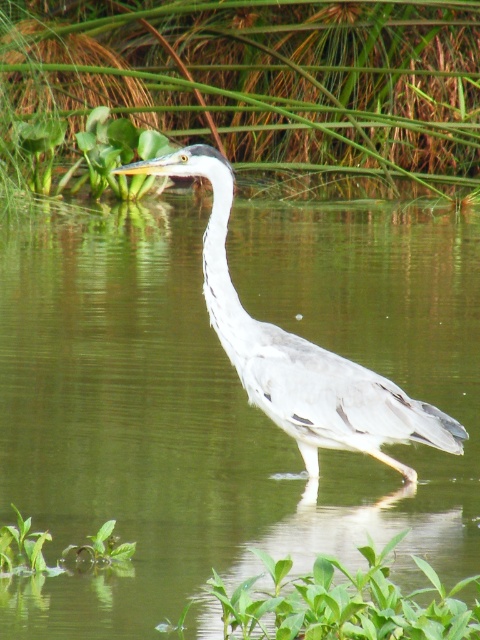
Between green smooth water at center and green leafy plant at upper center, which one has more height?

green smooth water at center is taller.

Is green smooth water at center to the right of green leafy plant at upper center from the viewer's perspective?

Correct, you'll find green smooth water at center to the right of green leafy plant at upper center.

Where is `green smooth water at center`? The height and width of the screenshot is (640, 480). green smooth water at center is located at coordinates (220, 397).

Can you confirm if green leafy plant at upper center is bigger than gray matte heron at center?

Actually, green leafy plant at upper center might be smaller than gray matte heron at center.

Does point (158, 68) lie behind point (335, 404)?

That is True.

Where is `green leafy plant at upper center`? The height and width of the screenshot is (640, 480). green leafy plant at upper center is located at coordinates (255, 88).

Is point (60, 221) behind point (287, 355)?

Yes, point (60, 221) is behind point (287, 355).

Does point (404, 508) lie behind point (294, 420)?

That is True.

At what (x,y) coordinates should I click in order to perform the action: click on green smooth water at center. Please return your answer as a coordinate pair (x, y). This screenshot has height=640, width=480. Looking at the image, I should click on (220, 397).